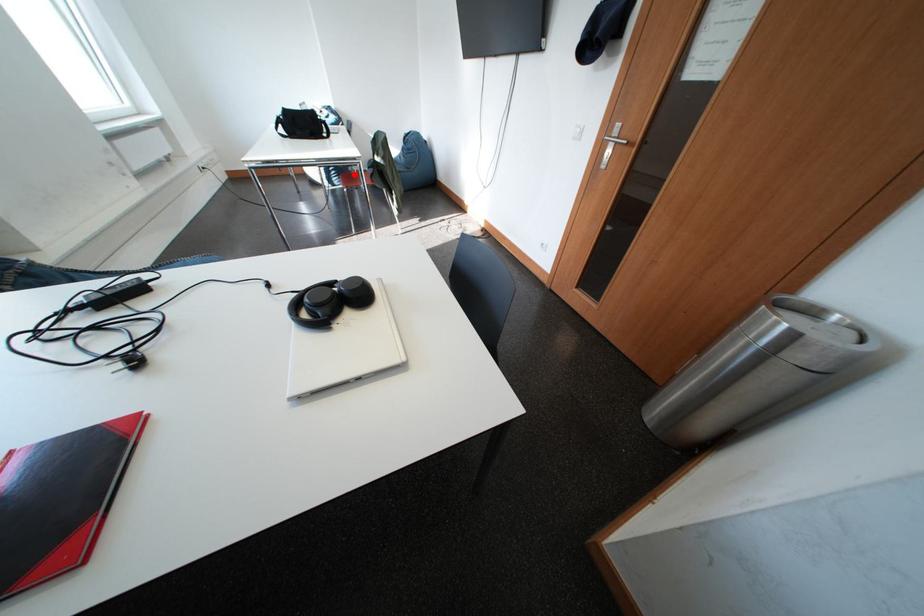
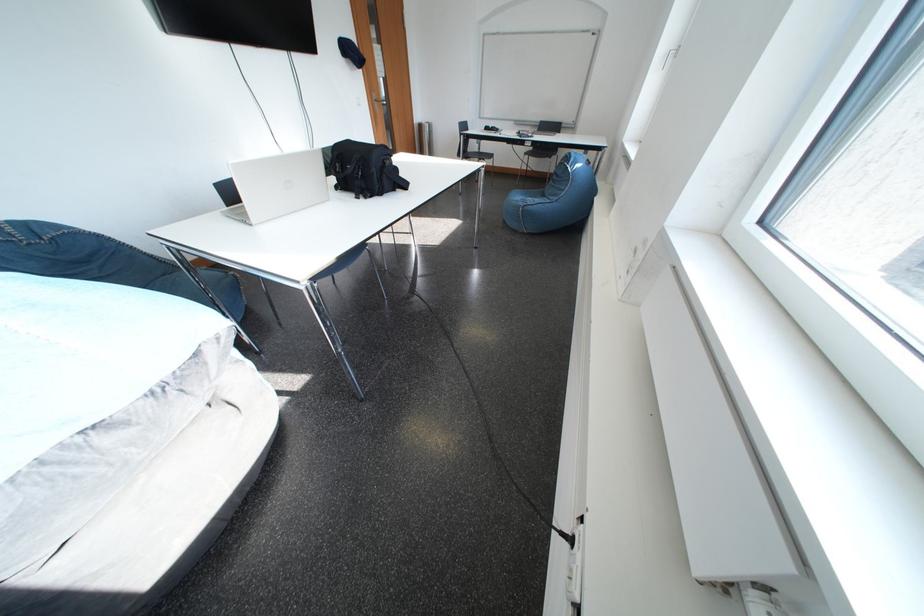
Question: I am providing you with two images of the same scene from different viewpoints. A red point is marked on the first image. Can you still see the location of the red point in image 2?

Choices:
 (A) Yes
 (B) No

Answer: (B)